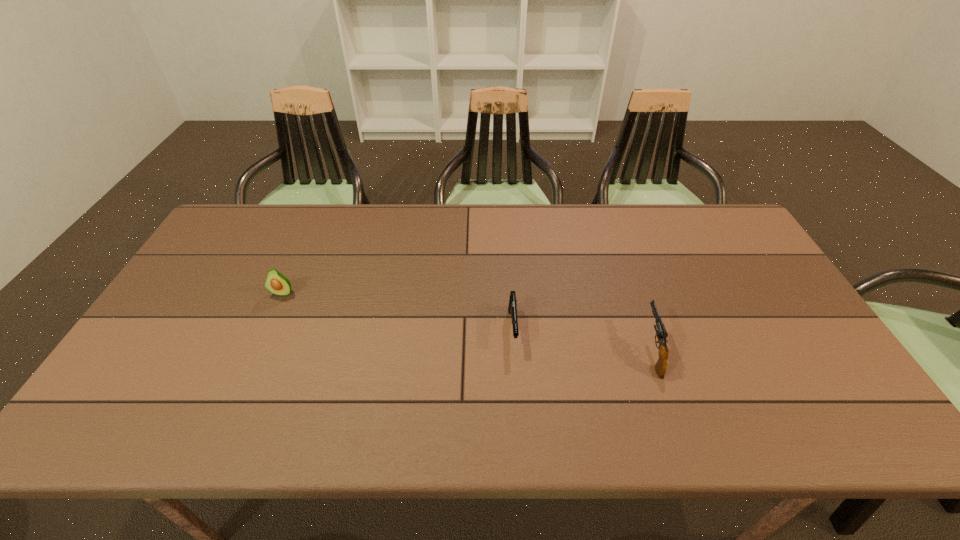
What are the coordinates of `vacant space that's between the right gun and the farthest object` in the screenshot? It's located at (468, 322).

Locate an element on the screen. This screenshot has width=960, height=540. vacant space that is in between the right gun and the avocado is located at coordinates (468, 322).

Find the location of a particular element. This screenshot has width=960, height=540. free space that is in between the leftmost object and the taller gun is located at coordinates (468, 322).

The image size is (960, 540). Identify the location of free point between the right gun and the avocado. (468, 322).

You are a GUI agent. You are given a task and a screenshot of the screen. Output one action in this format:
    pyautogui.click(x=<x>, y=<y>)
    Task: Click on the unoccupied position between the farthest object and the left gun
    This screenshot has height=540, width=960.
    Given the screenshot: What is the action you would take?
    pyautogui.click(x=397, y=310)

This screenshot has height=540, width=960. I want to click on free space between the rightmost object and the leftmost object, so click(468, 322).

Locate an element on the screen. This screenshot has width=960, height=540. vacant space that is in between the shorter gun and the avocado is located at coordinates (397, 310).

Locate which object is the second closest to the shorter gun. Please provide its 2D coordinates. Your answer should be formatted as a tuple, i.e. [(x, y)], where the tuple contains the x and y coordinates of a point satisfying the conditions above.

[(277, 283)]

Locate an element on the screen. This screenshot has height=540, width=960. object identified as the second closest to the rightmost object is located at coordinates (277, 283).